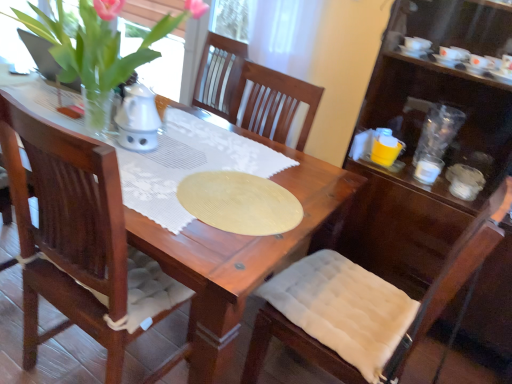
Question: Is white glossy cup at right, the second tableware viewed from the top, located within transparent plastic cups at right, positioned as the 1th tableware in top-to-bottom order?

Choices:
 (A) no
 (B) yes

Answer: (A)

Question: Is transparent plastic cups at right, marked as the second tableware in a bottom-to-top arrangement, thinner than white glossy cup at right, the second tableware viewed from the top?

Choices:
 (A) yes
 (B) no

Answer: (B)

Question: Is transparent plastic cups at right, positioned as the 1th tableware in top-to-bottom order, aimed at white glossy cup at right, the second tableware viewed from the top?

Choices:
 (A) no
 (B) yes

Answer: (B)

Question: From a real-world perspective, is transparent plastic cups at right, marked as the second tableware in a bottom-to-top arrangement, on white glossy cup at right, marked as the first tableware in a bottom-to-top arrangement?

Choices:
 (A) no
 (B) yes

Answer: (B)

Question: Can you confirm if transparent plastic cups at right, marked as the second tableware in a bottom-to-top arrangement, is wider than white glossy cup at right, the second tableware viewed from the top?

Choices:
 (A) no
 (B) yes

Answer: (B)

Question: Considering the relative sizes of transparent plastic cups at right, marked as the second tableware in a bottom-to-top arrangement, and white glossy cup at right, the second tableware viewed from the top, in the image provided, is transparent plastic cups at right, marked as the second tableware in a bottom-to-top arrangement, smaller than white glossy cup at right, the second tableware viewed from the top,?

Choices:
 (A) yes
 (B) no

Answer: (B)

Question: Can you confirm if green leafy plant at upper left is positioned to the right of white glossy cup at right, the second tableware viewed from the top?

Choices:
 (A) yes
 (B) no

Answer: (B)

Question: Is green leafy plant at upper left surrounding white glossy cup at right, marked as the first tableware in a bottom-to-top arrangement?

Choices:
 (A) no
 (B) yes

Answer: (A)

Question: From a real-world perspective, does green leafy plant at upper left sit lower than white glossy cup at right, marked as the first tableware in a bottom-to-top arrangement?

Choices:
 (A) no
 (B) yes

Answer: (A)

Question: From the image's perspective, is green leafy plant at upper left beneath white glossy cup at right, marked as the first tableware in a bottom-to-top arrangement?

Choices:
 (A) yes
 (B) no

Answer: (B)

Question: Can you confirm if green leafy plant at upper left is shorter than white glossy cup at right, the second tableware viewed from the top?

Choices:
 (A) yes
 (B) no

Answer: (B)

Question: Can you confirm if green leafy plant at upper left is taller than white glossy cup at right, the second tableware viewed from the top?

Choices:
 (A) no
 (B) yes

Answer: (B)

Question: Would you consider white fabric cushion at lower right to be distant from transparent plastic cups at right, marked as the second tableware in a bottom-to-top arrangement?

Choices:
 (A) yes
 (B) no

Answer: (B)